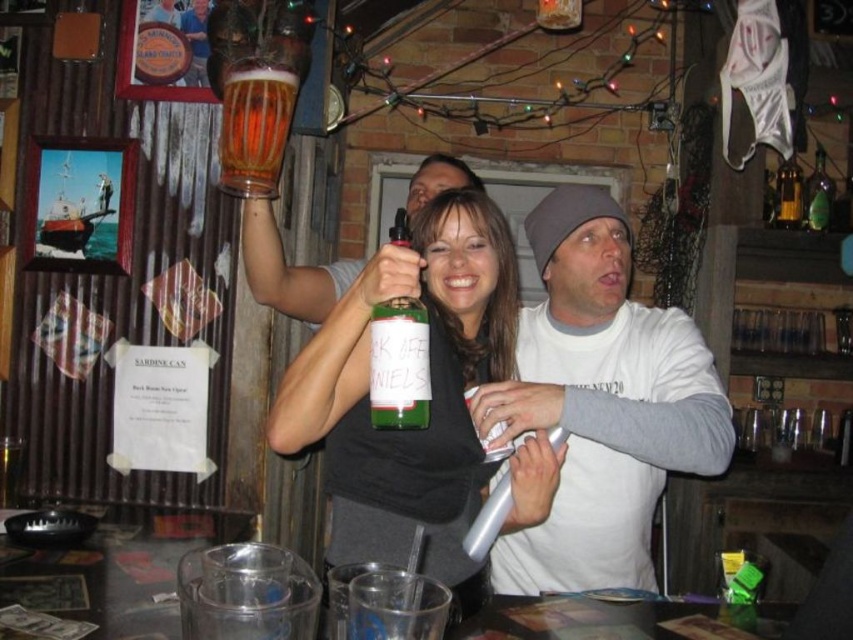
Looking at this image, you are a bartender who needs to place a new drink order. The white cotton shirt at center is worn by a customer who wants to order a drink. The green glass bottle at center contains the drink they want. How far apart are the customer and the bottle?

The white cotton shirt at center is 36.85 centimeters away from the green glass bottle at center.

You are a bartender at the bar and want to place a new menu board behind the translucent glass mug at upper center and the green glass bottle at upper right. Which object should the menu board be placed behind to ensure it is visible from the front?

The menu board should be placed behind the green glass bottle at upper right because the translucent glass mug at upper center is in front of it, so placing the menu board behind the green glass bottle at upper right would keep it visible from the front.

You are a bartender at the bar and need to place both the green glass bottle at center and the green glass bottle at upper right on a shelf that can only hold items up to 20 cm in height. Which bottle should you place first to ensure both fit?

The green glass bottle at center is not as tall as the green glass bottle at upper right. Therefore, you should place the taller green glass bottle at upper right first to ensure both fit on the shelf.